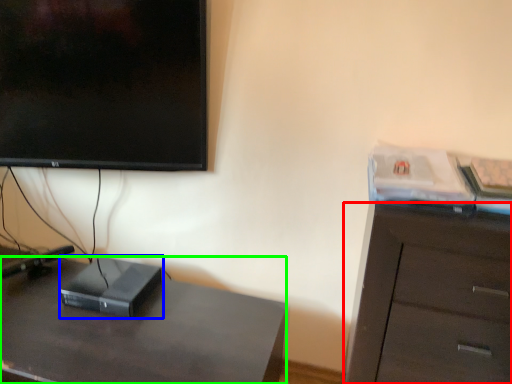
Question: Which object is positioned closest to cabinetry (highlighted by a red box)? Select from computer (highlighted by a blue box) and desk (highlighted by a green box).

Choices:
 (A) computer
 (B) desk

Answer: (B)